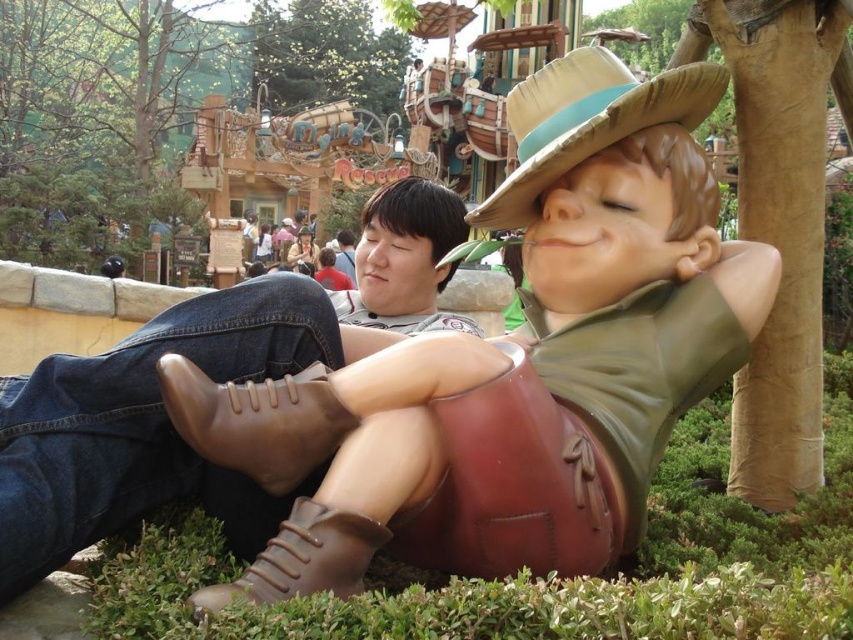
Question: Does brown leather boots at lower center appear on the left side of jeans at center?

Choices:
 (A) no
 (B) yes

Answer: (A)

Question: Which is nearer to the brown leather boots at lower center?

Choices:
 (A) brown straw hat at center
 (B) jeans at center

Answer: (A)

Question: Which of the following is the farthest from the observer?

Choices:
 (A) brown straw hat at center
 (B) jeans at center

Answer: (B)

Question: Is brown leather boots at lower center thinner than jeans at center?

Choices:
 (A) no
 (B) yes

Answer: (A)

Question: Which object is the closest to the brown leather boots at lower center?

Choices:
 (A) jeans at center
 (B) brown straw hat at center

Answer: (B)

Question: From the image, what is the correct spatial relationship of brown leather boots at lower center in relation to jeans at center?

Choices:
 (A) left
 (B) right

Answer: (B)